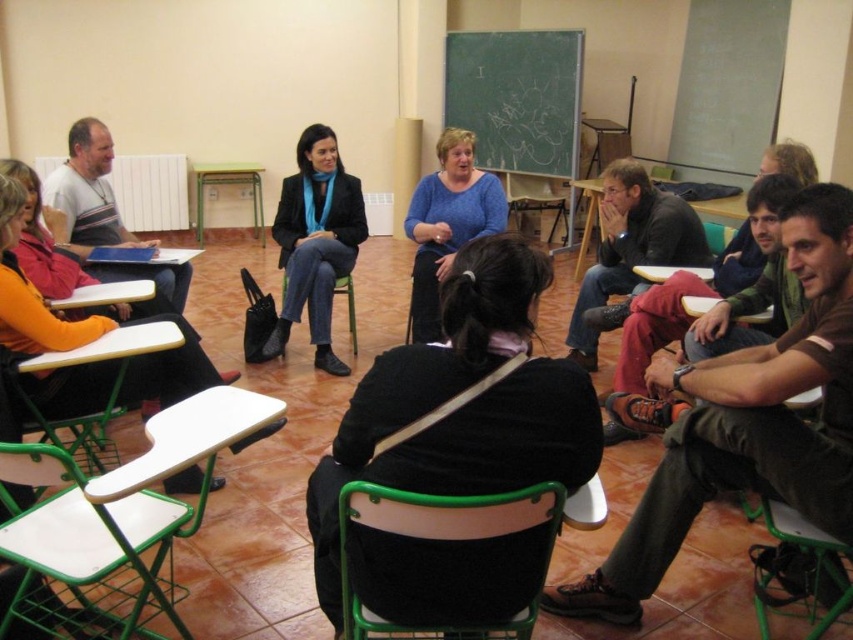
Question: Which of these objects is positioned closest to the green chalkboard at upper center?

Choices:
 (A) matte black blazer at center
 (B) green plastic chair at lower center

Answer: (A)

Question: Does orange sweater at left appear over green plastic chair at center?

Choices:
 (A) no
 (B) yes

Answer: (B)

Question: Is blue knitwear at center further to camera compared to green plastic chair at center?

Choices:
 (A) no
 (B) yes

Answer: (A)

Question: Which object appears closest to the camera in this image?

Choices:
 (A) green plastic chair at lower center
 (B) matte black blazer at center
 (C) orange sweater at left
 (D) black matte jacket at center

Answer: (A)

Question: Among these objects, which one is farthest from the camera?

Choices:
 (A) orange sweater at left
 (B) green plastic chair at center
 (C) wooden at center
 (D) black matte jacket at center

Answer: (C)

Question: Is green chalkboard at upper center to the left of matte black blazer at center from the viewer's perspective?

Choices:
 (A) yes
 (B) no

Answer: (B)